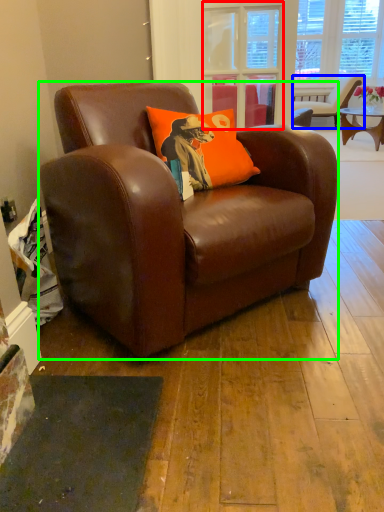
Question: Which is nearer to the glass door (highlighted by a red box)? chair (highlighted by a blue box) or chair (highlighted by a green box).

Choices:
 (A) chair
 (B) chair

Answer: (B)